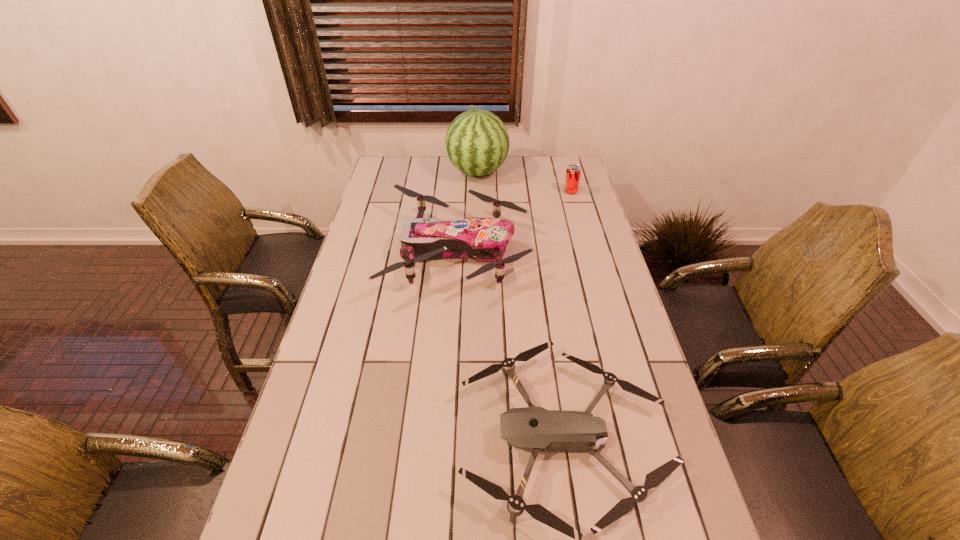
Identify the location of watermelon. Image resolution: width=960 pixels, height=540 pixels. (477, 142).

The height and width of the screenshot is (540, 960). Find the location of `the farther drone`. the farther drone is located at coordinates (482, 239).

Where is `the second nearest object`? the second nearest object is located at coordinates (482, 239).

The image size is (960, 540). I want to click on soda can, so point(573,172).

Locate an element on the screen. The height and width of the screenshot is (540, 960). free space located 0.270m on the front of the watermelon is located at coordinates (477, 227).

Image resolution: width=960 pixels, height=540 pixels. I want to click on vacant position located on the front-facing side of the farther drone, so click(605, 252).

Locate an element on the screen. The image size is (960, 540). vacant area located on the front of the soda can is located at coordinates (576, 212).

You are a GUI agent. You are given a task and a screenshot of the screen. Output one action in this format:
    pyautogui.click(x=<x>, y=<y>)
    Task: Click on the object that is at the far edge
    
    Given the screenshot: What is the action you would take?
    click(477, 142)

The width and height of the screenshot is (960, 540). Find the location of `object positioned at the left edge`. object positioned at the left edge is located at coordinates (482, 239).

Identify the location of object located at the right edge. This screenshot has height=540, width=960. (573, 172).